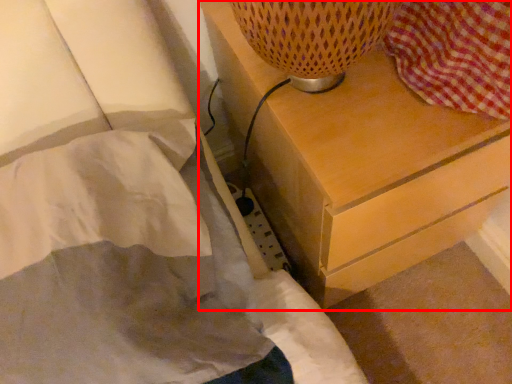
Question: From the image's perspective, what is the correct spatial relationship of chest of drawers (annotated by the red box) in relation to bed?

Choices:
 (A) above
 (B) below

Answer: (A)